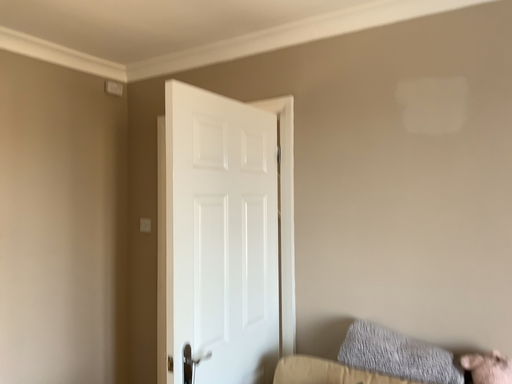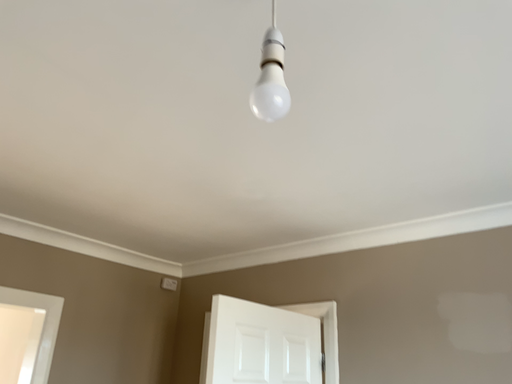
Question: Which way did the camera rotate in the video?

Choices:
 (A) rotated downward
 (B) rotated upward

Answer: (B)